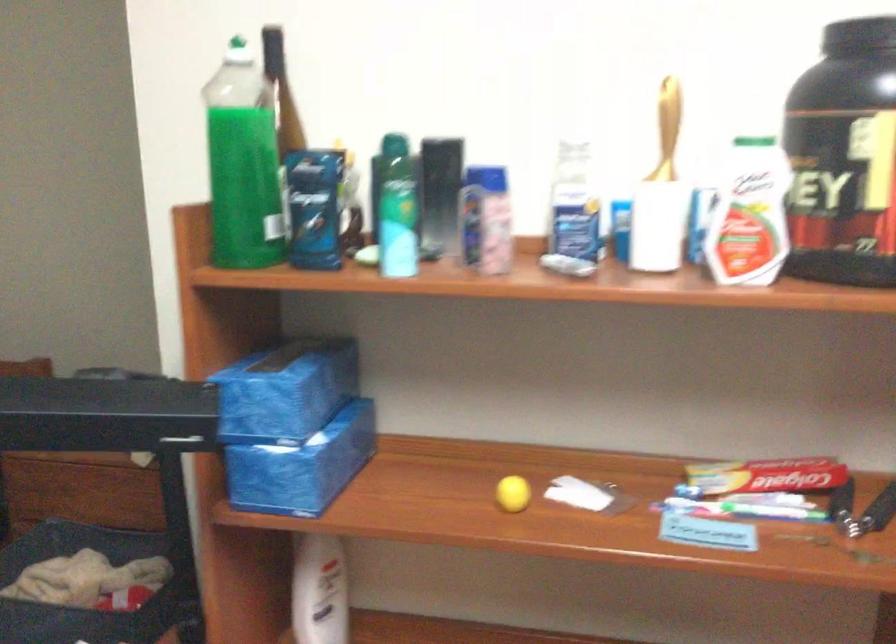
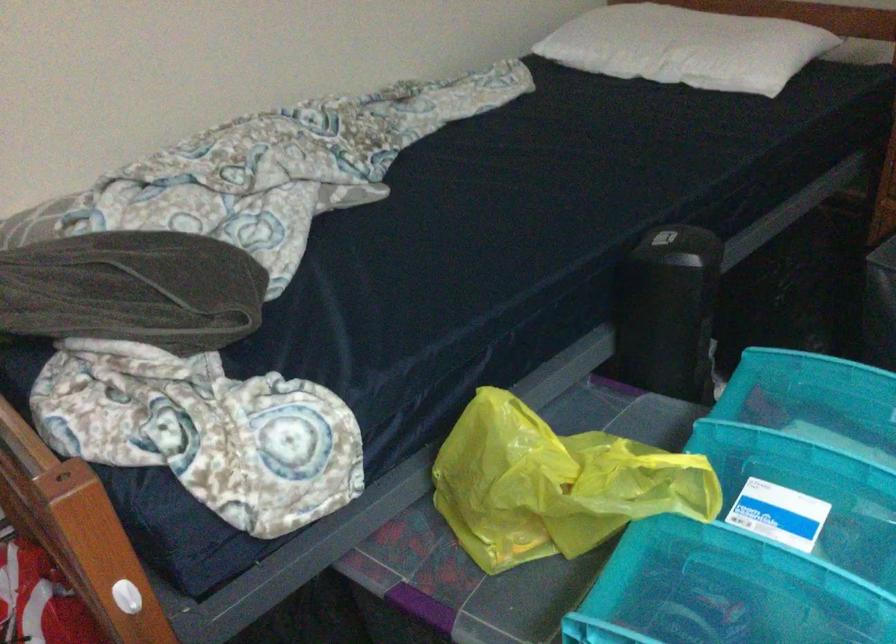
Based on the photo, based on the continuous images, in which direction is the camera rotating?

The rotation direction of the camera is left-down.